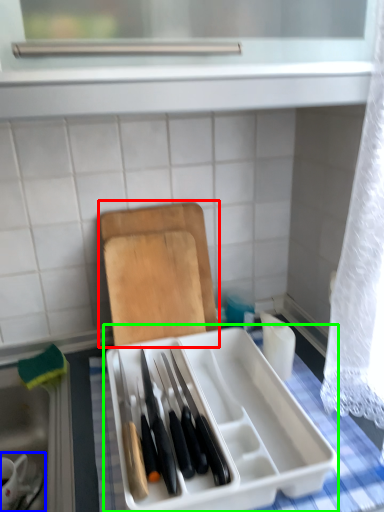
Question: Based on their relative distances, which object is nearer to cutting board (highlighted by a red box)? Choose from tableware (highlighted by a blue box) and appliance (highlighted by a green box).

Choices:
 (A) tableware
 (B) appliance

Answer: (B)